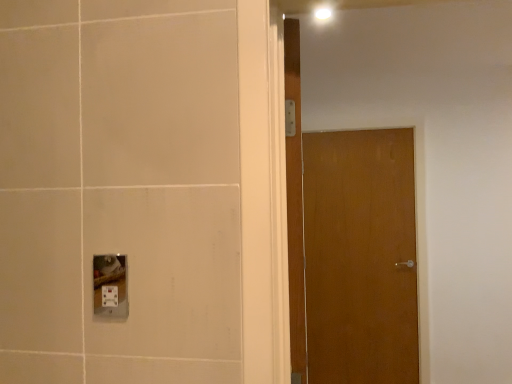
Question: Is wooden door at center, placed as the second door when sorted from right to left, wider than white plastic socket at lower left?

Choices:
 (A) yes
 (B) no

Answer: (A)

Question: Would you say wooden door at center, arranged as the first door when viewed from the front, is outside white plastic socket at lower left?

Choices:
 (A) yes
 (B) no

Answer: (A)

Question: Could you tell me if wooden door at center, placed as the second door when sorted from right to left, is turned towards white plastic socket at lower left?

Choices:
 (A) yes
 (B) no

Answer: (B)

Question: Can you confirm if wooden door at center, placed as the second door when sorted from right to left, is shorter than white plastic socket at lower left?

Choices:
 (A) yes
 (B) no

Answer: (B)

Question: Does wooden door at center, arranged as the first door when viewed from the front, have a larger size compared to white plastic socket at lower left?

Choices:
 (A) yes
 (B) no

Answer: (A)

Question: Considering their positions, is wooden door at center, placed as the second door when sorted from right to left, located in front of or behind white plastic socket at lower left?

Choices:
 (A) behind
 (B) front

Answer: (A)

Question: Considering the positions of wooden door at center, the 1th door when ordered from left to right, and white plastic socket at lower left in the image, is wooden door at center, the 1th door when ordered from left to right, bigger or smaller than white plastic socket at lower left?

Choices:
 (A) big
 (B) small

Answer: (A)

Question: Is point [x=298, y=41] closer or farther from the camera than point [x=98, y=286]?

Choices:
 (A) closer
 (B) farther

Answer: (A)

Question: Would you say wooden door at center, placed as the second door when sorted from right to left, is inside or outside white plastic socket at lower left?

Choices:
 (A) inside
 (B) outside

Answer: (B)

Question: From the image's perspective, is white plastic socket at lower left positioned above or below wooden door at center, which appears as the 1th door when viewed from the back?

Choices:
 (A) above
 (B) below

Answer: (A)

Question: Is white plastic socket at lower left inside the boundaries of wooden door at center, marked as the first door in a right-to-left arrangement, or outside?

Choices:
 (A) outside
 (B) inside

Answer: (A)

Question: In terms of width, does white plastic socket at lower left look wider or thinner when compared to wooden door at center, which is the second door from front to back?

Choices:
 (A) wide
 (B) thin

Answer: (B)

Question: Considering the positions of white plastic socket at lower left and wooden door at center, marked as the first door in a right-to-left arrangement, in the image, is white plastic socket at lower left taller or shorter than wooden door at center, marked as the first door in a right-to-left arrangement,?

Choices:
 (A) short
 (B) tall

Answer: (A)

Question: Relative to wooden door at center, arranged as the first door when viewed from the front, is white plastic socket at lower left in front or behind?

Choices:
 (A) front
 (B) behind

Answer: (A)

Question: In terms of height, does white plastic socket at lower left look taller or shorter compared to wooden door at center, placed as the second door when sorted from right to left?

Choices:
 (A) short
 (B) tall

Answer: (A)